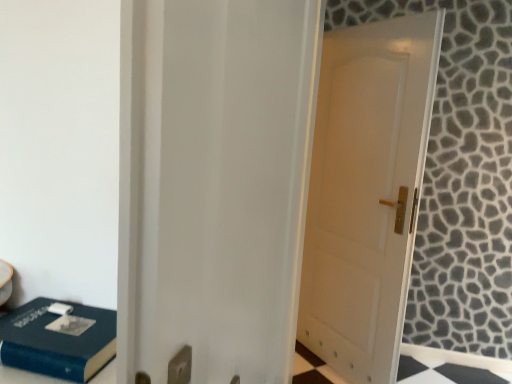
Question: Is white glossy door at center further to the viewer compared to white matte door at center?

Choices:
 (A) yes
 (B) no

Answer: (B)

Question: Is white glossy door at center to the left of white matte door at center from the viewer's perspective?

Choices:
 (A) no
 (B) yes

Answer: (B)

Question: Does white glossy door at center have a greater height compared to white matte door at center?

Choices:
 (A) no
 (B) yes

Answer: (A)

Question: Is white glossy door at center outside white matte door at center?

Choices:
 (A) no
 (B) yes

Answer: (B)

Question: Is white glossy door at center to the right of white matte door at center from the viewer's perspective?

Choices:
 (A) yes
 (B) no

Answer: (B)

Question: From the image's perspective, is white glossy door at center beneath white matte door at center?

Choices:
 (A) yes
 (B) no

Answer: (A)

Question: From a real-world perspective, is blue matte book at lower left positioned under white glossy door at center based on gravity?

Choices:
 (A) yes
 (B) no

Answer: (A)

Question: Is blue matte book at lower left taller than white glossy door at center?

Choices:
 (A) yes
 (B) no

Answer: (B)

Question: Is the position of blue matte book at lower left more distant than that of white glossy door at center?

Choices:
 (A) no
 (B) yes

Answer: (B)

Question: Does blue matte book at lower left come in front of white glossy door at center?

Choices:
 (A) yes
 (B) no

Answer: (B)

Question: Can you confirm if blue matte book at lower left is positioned to the left of white glossy door at center?

Choices:
 (A) yes
 (B) no

Answer: (A)

Question: Considering the relative sizes of blue matte book at lower left and white glossy door at center in the image provided, is blue matte book at lower left thinner than white glossy door at center?

Choices:
 (A) yes
 (B) no

Answer: (B)

Question: Does blue matte book at lower left have a lesser height compared to white matte door at center?

Choices:
 (A) no
 (B) yes

Answer: (B)